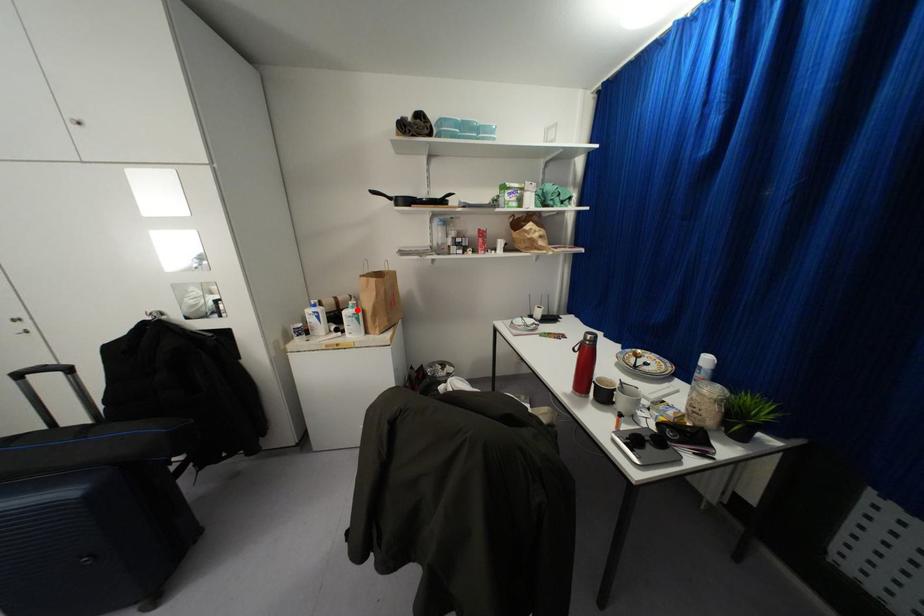
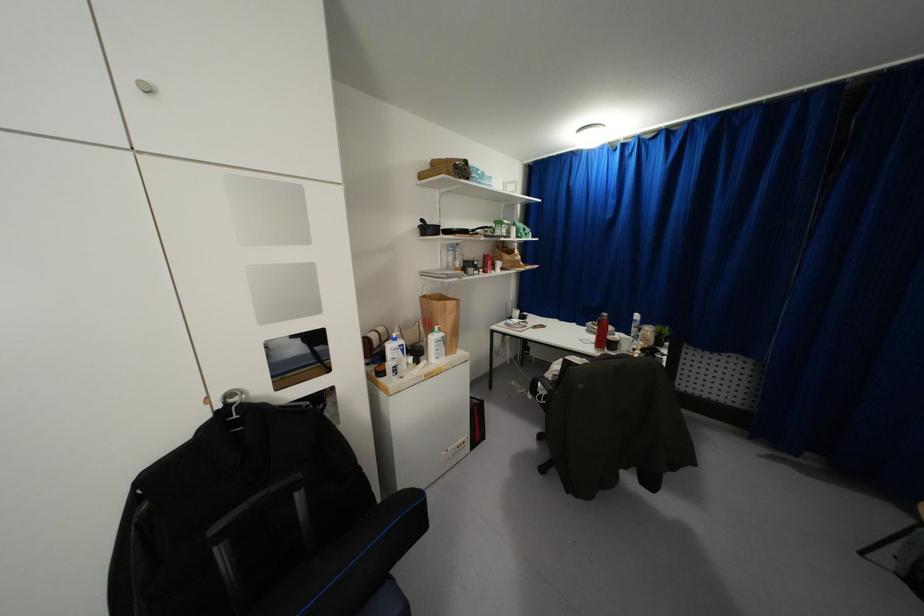
Locate, in the second image, the point that corresponds to the highlighted location in the first image.

(442, 333)